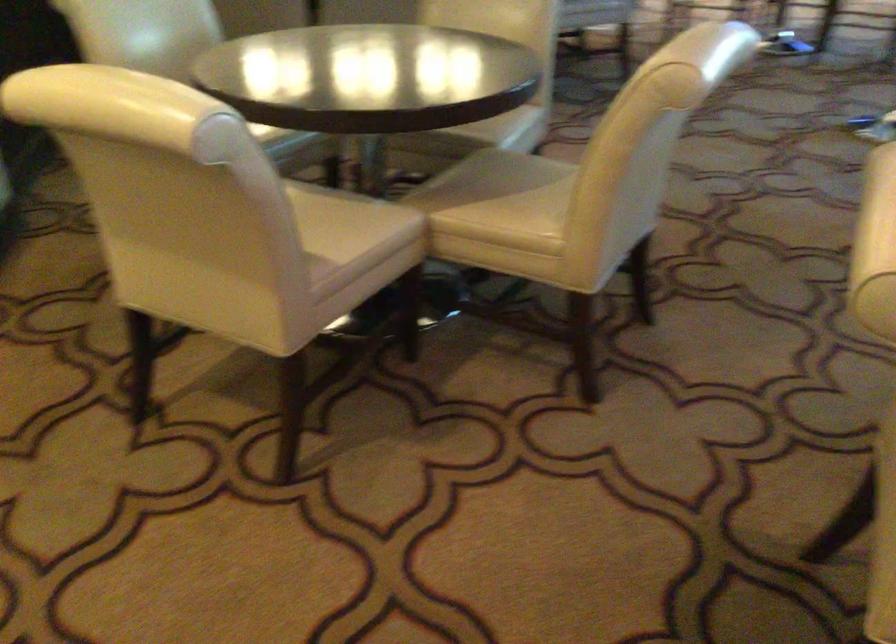
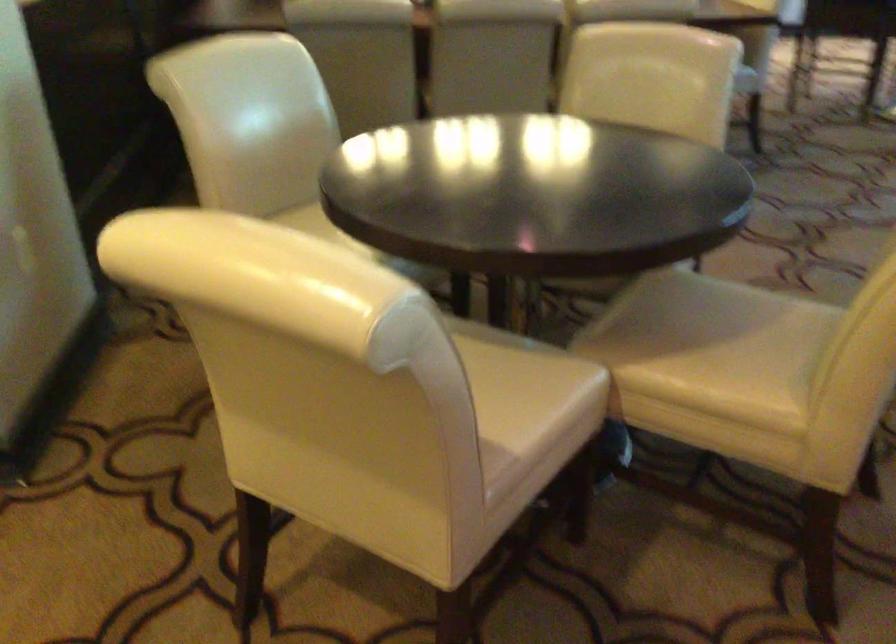
Question: The camera is either moving clockwise (left) or counter-clockwise (right) around the object. The first image is from the beginning of the video and the second image is from the end. Is the camera moving left or right when shooting the video?

Choices:
 (A) Left
 (B) Right

Answer: (B)